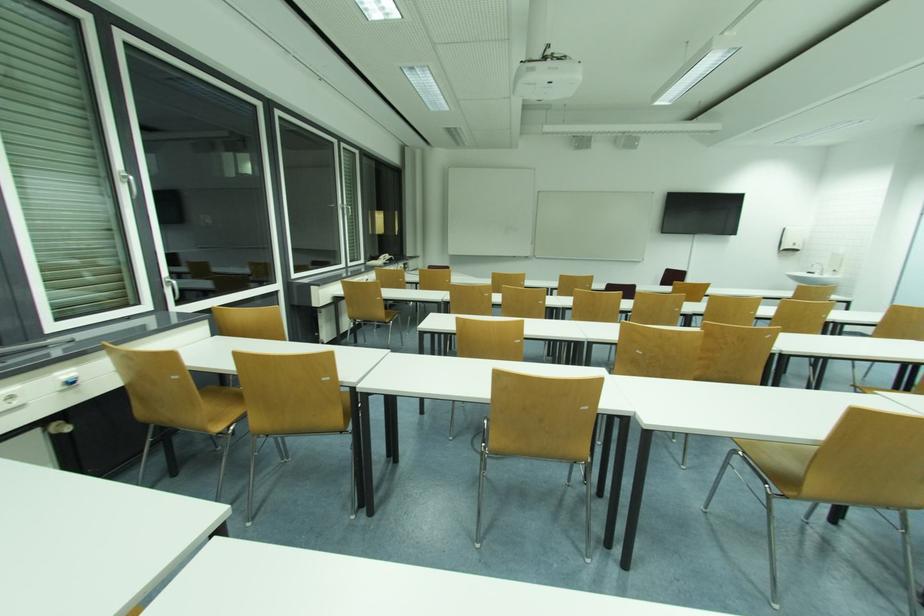
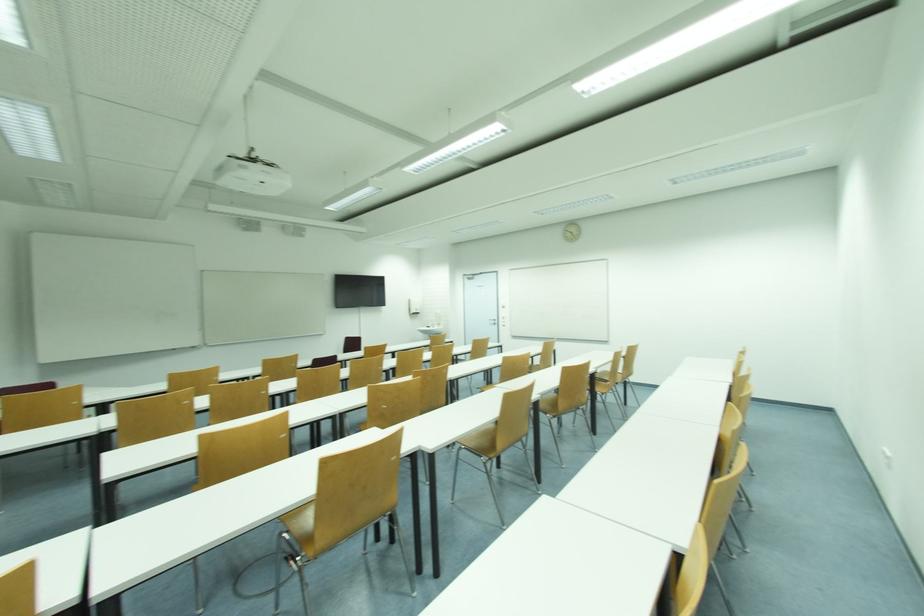
Question: The images are taken continuously from a first-person perspective. In which direction is your viewpoint rotating?

Choices:
 (A) Left
 (B) Right
 (C) Up
 (D) Down

Answer: (B)